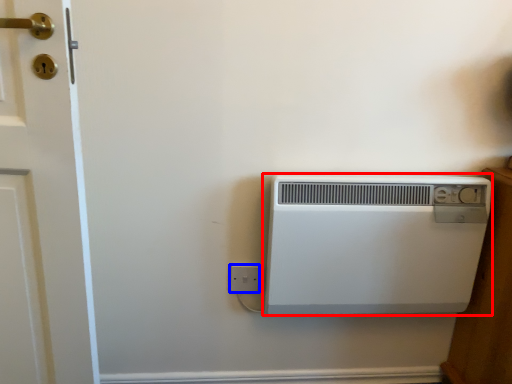
Question: Which of the following is the farthest to the observer, home appliance (highlighted by a red box) or electric outlet (highlighted by a blue box)?

Choices:
 (A) home appliance
 (B) electric outlet

Answer: (B)